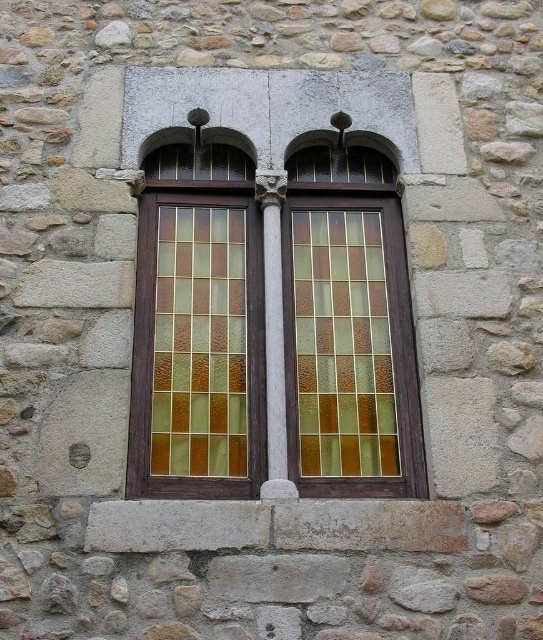
Question: Which of these objects is positioned farthest from the translucent amber tiles at center?

Choices:
 (A) wooden stained glass window at center
 (B) translucent amber glass at center

Answer: (B)

Question: Which of the following is the closest to the observer?

Choices:
 (A) (199, 362)
 (B) (400, 470)

Answer: (B)

Question: Is translucent amber tiles at center smaller than translucent amber glass at center?

Choices:
 (A) yes
 (B) no

Answer: (B)

Question: Is translucent amber tiles at center below translucent amber glass at center?

Choices:
 (A) no
 (B) yes

Answer: (B)

Question: Is wooden stained glass window at center below translucent amber glass at center?

Choices:
 (A) no
 (B) yes

Answer: (A)

Question: Which object is the closest to the wooden stained glass window at center?

Choices:
 (A) translucent amber tiles at center
 (B) translucent amber glass at center

Answer: (A)